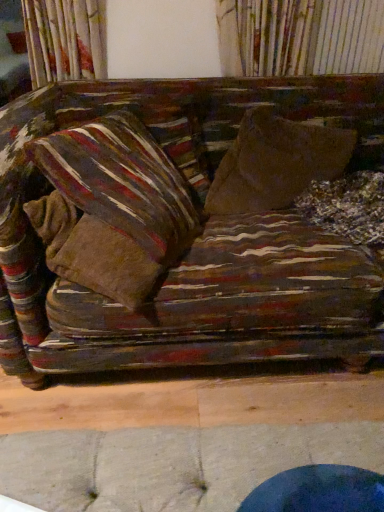
Question: Does striped fabric pillow at left, the 2th pillow when ordered from back to front, have a greater width compared to brown fabric throw pillow at center?

Choices:
 (A) no
 (B) yes

Answer: (A)

Question: Considering the relative positions of striped fabric pillow at left, the 1th pillow viewed from the front, and brown fabric throw pillow at center in the image provided, is striped fabric pillow at left, the 1th pillow viewed from the front, to the right of brown fabric throw pillow at center from the viewer's perspective?

Choices:
 (A) yes
 (B) no

Answer: (B)

Question: Considering the relative sizes of striped fabric pillow at left, the 2th pillow when ordered from back to front, and brown fabric throw pillow at center in the image provided, is striped fabric pillow at left, the 2th pillow when ordered from back to front, shorter than brown fabric throw pillow at center?

Choices:
 (A) no
 (B) yes

Answer: (A)

Question: Is striped fabric pillow at left, the 1th pillow viewed from the front, surrounding brown fabric throw pillow at center?

Choices:
 (A) no
 (B) yes

Answer: (A)

Question: From a real-world perspective, does striped fabric pillow at left, the 1th pillow viewed from the front, stand above brown fabric throw pillow at center?

Choices:
 (A) no
 (B) yes

Answer: (B)

Question: Based on their sizes in the image, would you say brown fabric throw pillow at center is bigger or smaller than striped fabric pillow at upper left, arranged as the first pillow when viewed from the back?

Choices:
 (A) big
 (B) small

Answer: (A)

Question: Based on their positions, is brown fabric throw pillow at center located to the left or right of striped fabric pillow at upper left, the 2th pillow positioned from the front?

Choices:
 (A) left
 (B) right

Answer: (B)

Question: From the image's perspective, is brown fabric throw pillow at center located above or below striped fabric pillow at upper left, the 2th pillow positioned from the front?

Choices:
 (A) below
 (B) above

Answer: (A)

Question: In terms of width, does brown fabric throw pillow at center look wider or thinner when compared to striped fabric pillow at upper left, arranged as the first pillow when viewed from the back?

Choices:
 (A) wide
 (B) thin

Answer: (A)

Question: Is brown fabric throw pillow at center bigger or smaller than striped fabric pillow at left, the 1th pillow viewed from the front?

Choices:
 (A) small
 (B) big

Answer: (B)

Question: Is brown fabric throw pillow at center inside the boundaries of striped fabric pillow at left, the 1th pillow viewed from the front, or outside?

Choices:
 (A) outside
 (B) inside

Answer: (A)

Question: Is brown fabric throw pillow at center in front of or behind striped fabric pillow at left, the 2th pillow when ordered from back to front, in the image?

Choices:
 (A) front
 (B) behind

Answer: (B)

Question: Does point (240, 196) appear closer or farther from the camera than point (162, 172)?

Choices:
 (A) closer
 (B) farther

Answer: (B)

Question: From the image's perspective, relative to striped fabric pillow at left, the 1th pillow viewed from the front, is striped fabric pillow at upper left, the 2th pillow positioned from the front, above or below?

Choices:
 (A) above
 (B) below

Answer: (A)

Question: From a real-world perspective, is striped fabric pillow at upper left, the 2th pillow positioned from the front, above or below striped fabric pillow at left, the 1th pillow viewed from the front?

Choices:
 (A) below
 (B) above

Answer: (A)